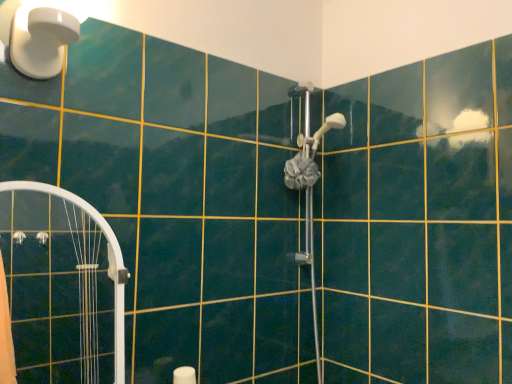
Question: From their relative heights in the image, would you say white plastic light fixture at upper left is taller or shorter than satin silver shower head at center, marked as the second shower in a top-to-bottom arrangement?

Choices:
 (A) tall
 (B) short

Answer: (B)

Question: From a real-world perspective, is white plastic light fixture at upper left above or below satin silver shower head at center, marked as the second shower in a top-to-bottom arrangement?

Choices:
 (A) above
 (B) below

Answer: (A)

Question: Based on their relative distances, which object is nearer to the satin silver shower head at center, positioned as the 2th shower in bottom-to-top order?

Choices:
 (A) satin silver shower head at center, marked as the second shower in a top-to-bottom arrangement
 (B) white glossy shower door at left
 (C) white plastic light fixture at upper left

Answer: (A)

Question: Which of these objects is positioned farthest from the satin silver shower head at center, positioned as the 2th shower in bottom-to-top order?

Choices:
 (A) white plastic light fixture at upper left
 (B) white glossy shower door at left
 (C) satin silver shower head at center, marked as the second shower in a top-to-bottom arrangement

Answer: (A)